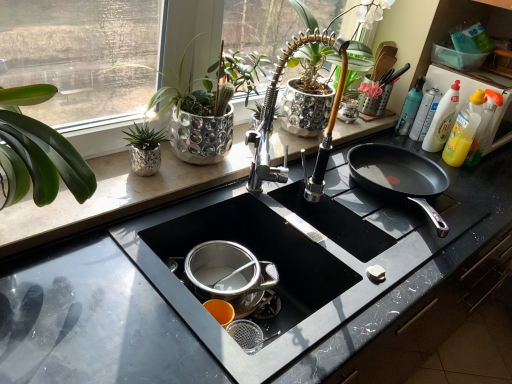
At what (x,y) coordinates should I click in order to perform the action: click on unoccupied region to the right of green glossy plant at upper left, placed as the first houseplant when sorted from left to right. Please return your answer as a coordinate pair (x, y). This screenshot has height=384, width=512. Looking at the image, I should click on (193, 180).